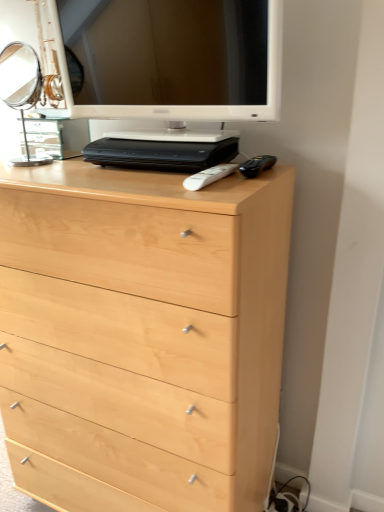
Question: Is polished silver mirror at upper left inside or outside of light wood chest of drawers at center?

Choices:
 (A) outside
 (B) inside

Answer: (A)

Question: Is polished silver mirror at upper left wider or thinner than light wood chest of drawers at center?

Choices:
 (A) thin
 (B) wide

Answer: (A)

Question: Estimate the real-world distances between objects in this image. Which object is farther from the polished silver mirror at upper left?

Choices:
 (A) white glossy computer monitor at upper center
 (B) light wood chest of drawers at center
 (C) white plastic remote at center

Answer: (C)

Question: Based on their relative distances, which object is farther from the polished silver mirror at upper left?

Choices:
 (A) light wood chest of drawers at center
 (B) white glossy computer monitor at upper center
 (C) white plastic remote at center

Answer: (C)